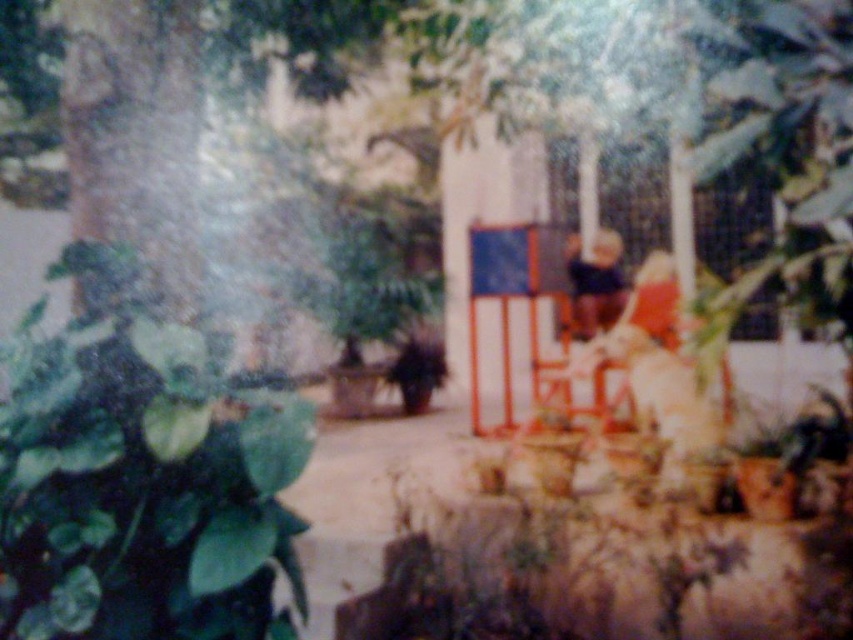
You are standing in the garden and want to place a small statue exactly at the center of the green matte leaf at lower left. What coordinates should you use?

The coordinates for the green matte leaf at lower left are at point (140, 474), so you should place the statue at those coordinates.

You are standing in the outdoor area and want to move from the large green plant on the left to the orange chair where the person is sitting. Which of the two points, point (675,330) or point (595,280), is closer to you as you start moving towards the orange chair?

Point (675,330) is closer to the viewer than point (595,280), so it would be the first point encountered when moving towards the orange chair.